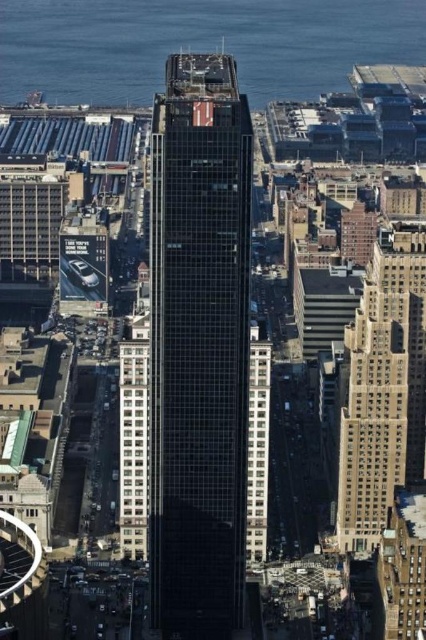
From the picture: Does black glass skyscraper at center appear under blue glass water at upper center?

Yes.

Who is positioned more to the left, black glass skyscraper at center or blue glass water at upper center?

Positioned to the left is black glass skyscraper at center.

Find the location of `black glass skyscraper at center`. black glass skyscraper at center is located at coordinates (198, 348).

Which of these two, black glass skyscraper at center or beige stone building at right, stands shorter?

beige stone building at right is shorter.

In the scene shown: Which is more to the left, black glass skyscraper at center or beige stone building at right?

black glass skyscraper at center

Locate an element on the screen. The width and height of the screenshot is (426, 640). black glass skyscraper at center is located at coordinates (198, 348).

Between blue glass water at upper center and beige stone building at right, which one appears on the right side from the viewer's perspective?

beige stone building at right

Can you confirm if blue glass water at upper center is thinner than beige stone building at right?

In fact, blue glass water at upper center might be wider than beige stone building at right.

In the scene shown: Measure the distance between blue glass water at upper center and camera.

A distance of 655.31 meters exists between blue glass water at upper center and camera.

This screenshot has width=426, height=640. Find the location of `blue glass water at upper center`. blue glass water at upper center is located at coordinates (198, 44).